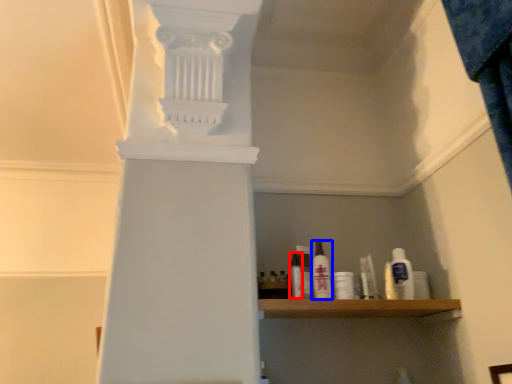
Question: Which point is further to the camera, toiletry (highlighted by a red box) or toiletry (highlighted by a blue box)?

Choices:
 (A) toiletry
 (B) toiletry

Answer: (B)